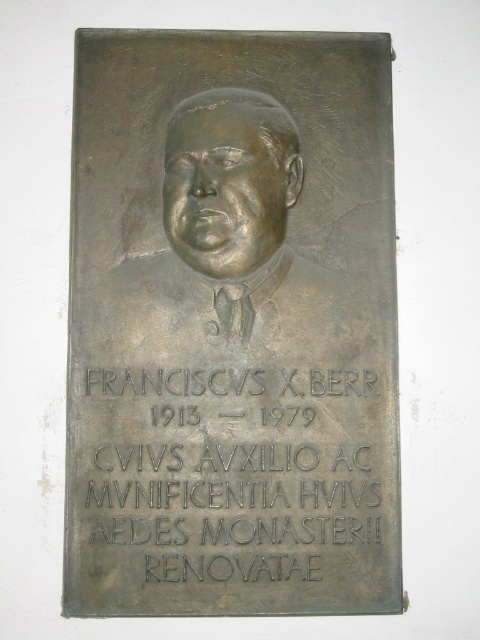
What is the relationship between the bronze engraving at center and the bronze relief bust at center in terms of their vertical positioning?

The bronze engraving at center is positioned below the bronze relief bust at center.

What are the coordinates of the bronze relief at center?

The bronze relief at center is located at point (231, 326).